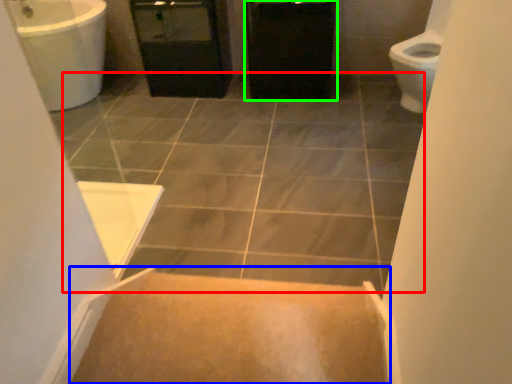
Question: Which object is positioned closest to ceramic tile (highlighted by a red box)? Select from stairs (highlighted by a blue box) and cabinetry (highlighted by a green box).

Choices:
 (A) stairs
 (B) cabinetry

Answer: (B)